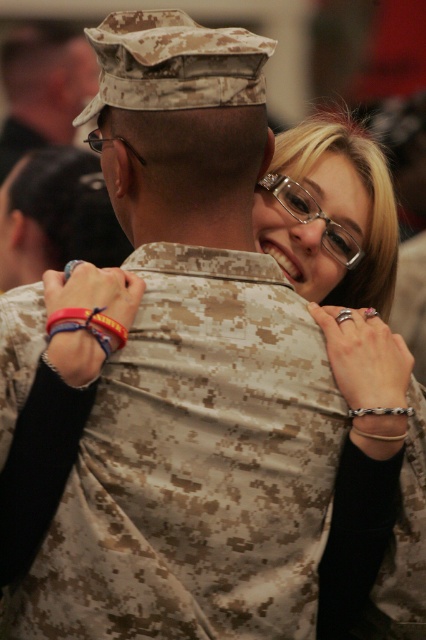
The width and height of the screenshot is (426, 640). What do you see at coordinates (55, 216) in the screenshot?
I see `camouflage uniform at center` at bounding box center [55, 216].

Is camouflage uniform at center above camouflage uniform at upper left?

Actually, camouflage uniform at center is below camouflage uniform at upper left.

Does point (55, 211) come in front of point (23, 61)?

That is True.

Where is `camouflage uniform at center`? Image resolution: width=426 pixels, height=640 pixels. camouflage uniform at center is located at coordinates (55, 216).

Which is below, matte black glasses at upper right or camouflage uniform at upper left?

Positioned lower is matte black glasses at upper right.

Is matte black glasses at upper right bigger than camouflage uniform at upper left?

No, matte black glasses at upper right is not bigger than camouflage uniform at upper left.

Is point (324, 586) farther from camera compared to point (11, 113)?

No, it is not.

The width and height of the screenshot is (426, 640). Identify the location of matte black glasses at upper right. (345, 332).

Does matte black glasses at upper right have a lesser height compared to camouflage uniform at center?

Indeed, matte black glasses at upper right has a lesser height compared to camouflage uniform at center.

From the picture: Can you confirm if matte black glasses at upper right is wider than camouflage uniform at center?

No, matte black glasses at upper right is not wider than camouflage uniform at center.

Is point (353, 442) behind point (40, 156)?

No, it is not.

Where is `matte black glasses at upper right`? Image resolution: width=426 pixels, height=640 pixels. matte black glasses at upper right is located at coordinates click(x=345, y=332).